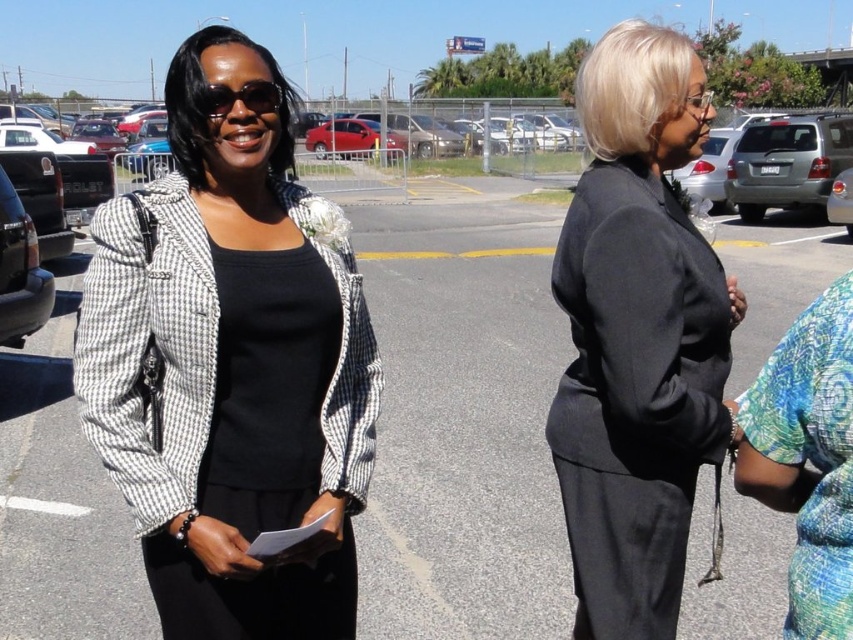
You are a delivery person trying to deliver a package to the shiny red sedan at center. You see the houndstooth fabric jacket at left in the way. Is the jacket blocking the path to the sedan?

The houndstooth fabric jacket at left is positioned under the shiny red sedan at center, so the jacket is not blocking the path to the sedan. The jacket is located underneath the vehicle, meaning it is likely placed inside or beneath the sedan and not obstructing access from the outside.

You are a delivery driver who needs to park your vehicle in a spot that can accommodate larger vehicles. Based on the scene, which vehicle between the silver metallic suv at right and the shiny red sedan at center would require a bigger parking space?

The silver metallic suv at right is larger in size than the shiny red sedan at center, so it would require a bigger parking space.